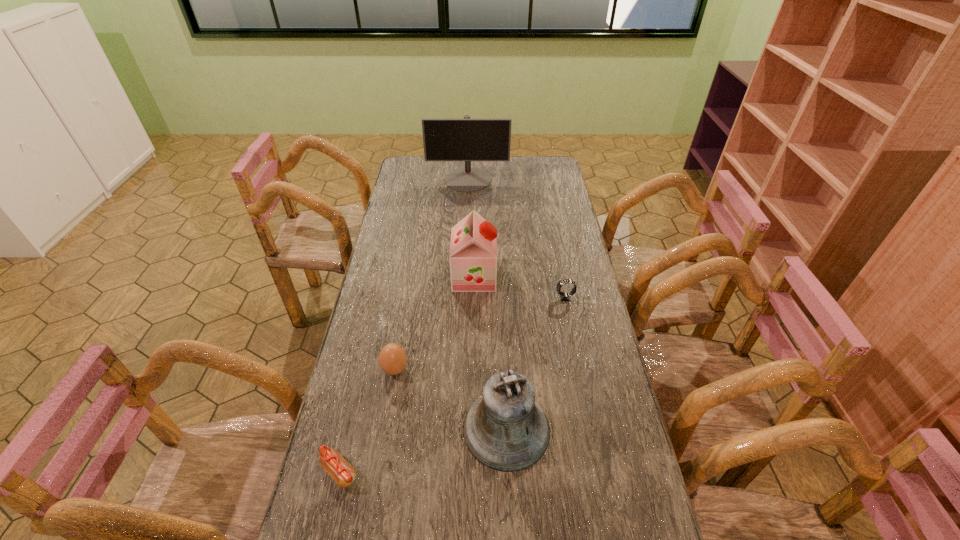
I want to click on the farthest object, so click(466, 139).

Find the location of a particular element. Image resolution: width=960 pixels, height=540 pixels. soya milk is located at coordinates (473, 247).

This screenshot has height=540, width=960. What are the coordinates of `bell` in the screenshot? It's located at (505, 429).

The height and width of the screenshot is (540, 960). I want to click on the third shortest object, so click(x=392, y=359).

The height and width of the screenshot is (540, 960). Identify the location of the third nearest object. (392, 359).

Identify the location of watch. (564, 296).

Find the location of a particular element. This screenshot has width=960, height=540. the third farthest object is located at coordinates (564, 296).

In order to click on sausage in this screenshot , I will do `click(335, 465)`.

The width and height of the screenshot is (960, 540). I want to click on the shortest object, so click(x=335, y=465).

Locate an element on the screen. blank space located 0.260m on the screen of the computer monitor is located at coordinates click(466, 226).